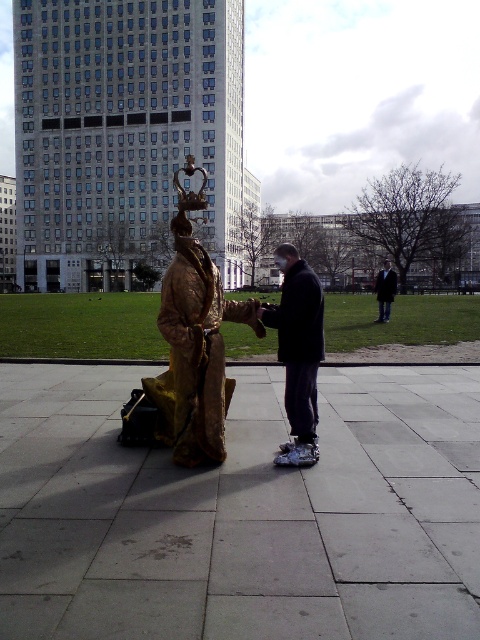
Question: Does metallic gold statue at center have a lesser width compared to dark brown leather jacket at center?

Choices:
 (A) yes
 (B) no

Answer: (A)

Question: Which point is farther to the camera?

Choices:
 (A) metallic gold statue at center
 (B) dark brown leather jacket at center

Answer: (B)

Question: Which point is closer to the camera taking this photo?

Choices:
 (A) (197, 294)
 (B) (309, 300)
 (C) (388, 268)

Answer: (A)

Question: Is bronze statue at center to the right of metallic gold statue at center from the viewer's perspective?

Choices:
 (A) yes
 (B) no

Answer: (B)

Question: Is bronze statue at center positioned at the back of metallic gold statue at center?

Choices:
 (A) yes
 (B) no

Answer: (B)

Question: Based on their relative distances, which object is farther from the dark brown leather jacket at center?

Choices:
 (A) metallic gold statue at center
 (B) bronze statue at center

Answer: (B)